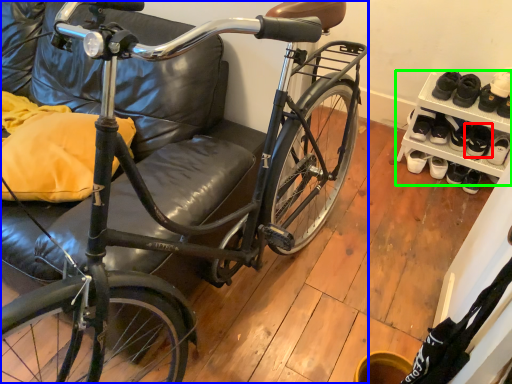
Question: Which object is the farthest from footwear (highlighted by a red box)? Choose among these: bicycle (highlighted by a blue box) or shelf (highlighted by a green box).

Choices:
 (A) bicycle
 (B) shelf

Answer: (A)